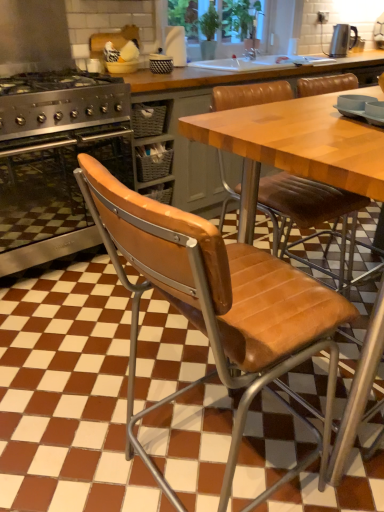
This screenshot has width=384, height=512. What do you see at coordinates (54, 195) in the screenshot?
I see `stainless steel oven at left` at bounding box center [54, 195].

This screenshot has height=512, width=384. Describe the element at coordinates (342, 40) in the screenshot. I see `metallic silver kettle at upper right` at that location.

Where is `brown leather chair at center`? The height and width of the screenshot is (512, 384). brown leather chair at center is located at coordinates (218, 308).

Describe the element at coordinates (218, 308) in the screenshot. This screenshot has height=512, width=384. I see `brown leather chair at center` at that location.

Identify the location of wooden table at center. (294, 147).

Between stainless steel oven at left and metallic silver kettle at upper right, which one has more height?

stainless steel oven at left.

Is stainless steel oven at left bigger than metallic silver kettle at upper right?

Yes.

What's the angular difference between stainless steel oven at left and metallic silver kettle at upper right's facing directions?

They differ by 5.26 degrees in their facing directions.

I want to click on kitchen appliance above the stainless steel oven at left (from a real-world perspective), so click(342, 40).

Between wooden table at center and stainless steel oven at left, which one appears on the left side from the viewer's perspective?

stainless steel oven at left is more to the left.

From the image's perspective, would you say wooden table at center is positioned over stainless steel oven at left?

→ No, from the image's perspective, wooden table at center is not on top of stainless steel oven at left.

Between wooden table at center and stainless steel oven at left, which one has smaller size?

With smaller size is wooden table at center.

Considering the positions of point (253, 182) and point (42, 187), is point (253, 182) closer or farther from the camera than point (42, 187)?

Point (253, 182).

Can you confirm if brown leather chair at center is bigger than stainless steel oven at left?

Actually, brown leather chair at center might be smaller than stainless steel oven at left.

Does brown leather chair at center touch stainless steel oven at left?

No.

Considering the relative sizes of brown leather chair at center and stainless steel oven at left in the image provided, is brown leather chair at center shorter than stainless steel oven at left?

In fact, brown leather chair at center may be taller than stainless steel oven at left.

Which of these two, stainless steel oven at left or wooden table at center, is smaller?

wooden table at center is smaller.

How much distance is there between stainless steel oven at left and wooden table at center?

A distance of 1.16 meters exists between stainless steel oven at left and wooden table at center.

Does point (128, 175) lie behind point (288, 154)?

That is True.

Do you think stainless steel oven at left is within wooden table at center, or outside of it?

stainless steel oven at left is not enclosed by wooden table at center.

From a real-world perspective, between metallic silver kettle at upper right and stainless steel oven at left, who is vertically higher?

From a 3D spatial view, metallic silver kettle at upper right is above.

Considering the points (333, 42) and (46, 260), which point is in front, point (333, 42) or point (46, 260)?

The point (46, 260) is in front.

Is metallic silver kettle at upper right turned away from stainless steel oven at left?

No.

From the image's perspective, does metallic silver kettle at upper right appear lower than stainless steel oven at left?

No, from the image's perspective, metallic silver kettle at upper right is not beneath stainless steel oven at left.

Is brown leather chair at center not close to wooden table at center?

No, there isn't a large distance between brown leather chair at center and wooden table at center.

Considering the relative sizes of brown leather chair at center and wooden table at center in the image provided, is brown leather chair at center shorter than wooden table at center?

No, brown leather chair at center is not shorter than wooden table at center.

Is brown leather chair at center thinner than wooden table at center?

Indeed, brown leather chair at center has a lesser width compared to wooden table at center.

I want to click on chair that is in front of the wooden table at center, so click(218, 308).

Consider the image. Which of these two, metallic silver kettle at upper right or brown leather chair at center, stands taller?

Standing taller between the two is brown leather chair at center.

Is metallic silver kettle at upper right further to camera compared to brown leather chair at center?

Yes, metallic silver kettle at upper right is further from the camera.

From a real-world perspective, is metallic silver kettle at upper right physically located above or below brown leather chair at center?

In terms of real-world spatial position, metallic silver kettle at upper right is above brown leather chair at center.

Between metallic silver kettle at upper right and brown leather chair at center, which one has larger width?

With larger width is brown leather chair at center.

Image resolution: width=384 pixels, height=512 pixels. Find the location of `kitchen appliance above the stainless steel oven at left (from the image's perspective)`. kitchen appliance above the stainless steel oven at left (from the image's perspective) is located at coordinates (342, 40).

At what (x,y) coordinates should I click in order to perform the action: click on table above the stainless steel oven at left (from a real-world perspective). Please return your answer as a coordinate pair (x, y). Looking at the image, I should click on (294, 147).

Looking at the image, which one is located closer to metallic silver kettle at upper right, brown leather chair at center or wooden table at center?

wooden table at center.

Which object lies nearer to the anchor point stainless steel oven at left, brown leather chair at center or metallic silver kettle at upper right?

brown leather chair at center is positioned closer to the anchor stainless steel oven at left.

From the image, which object appears to be farther from stainless steel oven at left, metallic silver kettle at upper right or wooden table at center?

metallic silver kettle at upper right is further to stainless steel oven at left.

Looking at the image, which one is located further to wooden table at center, metallic silver kettle at upper right or brown leather chair at center?

metallic silver kettle at upper right is further to wooden table at center.

Looking at the image, which one is located further to wooden table at center, stainless steel oven at left or brown leather chair at center?

stainless steel oven at left.

When comparing their distances from brown leather chair at center, does stainless steel oven at left or metallic silver kettle at upper right seem closer?

Among the two, stainless steel oven at left is located nearer to brown leather chair at center.

When comparing their distances from metallic silver kettle at upper right, does wooden table at center or stainless steel oven at left seem closer?

Among the two, stainless steel oven at left is located nearer to metallic silver kettle at upper right.

Based on their spatial positions, is stainless steel oven at left or wooden table at center closer to brown leather chair at center?

wooden table at center lies closer to brown leather chair at center than the other object.

Where is `table between brown leather chair at center and stainless steel oven at left in the front-back direction`? table between brown leather chair at center and stainless steel oven at left in the front-back direction is located at coordinates [294, 147].

This screenshot has width=384, height=512. Find the location of `oven located between wooden table at center and metallic silver kettle at upper right in the depth direction`. oven located between wooden table at center and metallic silver kettle at upper right in the depth direction is located at coordinates (54, 195).

Identify the location of oven positioned between brown leather chair at center and metallic silver kettle at upper right from near to far. The image size is (384, 512). (54, 195).

Identify the location of table between brown leather chair at center and metallic silver kettle at upper right in the front-back direction. This screenshot has height=512, width=384. (294, 147).